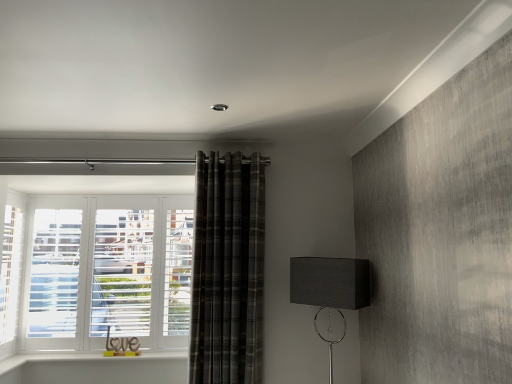
Locate an element on the screen. plaid fabric curtain at center is located at coordinates (228, 270).

Describe the element at coordinates (228, 270) in the screenshot. I see `plaid fabric curtain at center` at that location.

Measure the distance between point (257, 185) and camera.

They are 8.64 feet apart.

What do you see at coordinates (330, 288) in the screenshot? I see `matte black rectangular lampshade at lower right` at bounding box center [330, 288].

Image resolution: width=512 pixels, height=384 pixels. I want to click on matte black rectangular lampshade at lower right, so click(x=330, y=288).

Image resolution: width=512 pixels, height=384 pixels. I want to click on plaid fabric curtain at center, so click(x=228, y=270).

Which object is positioned more to the right, matte black rectangular lampshade at lower right or plaid fabric curtain at center?

From the viewer's perspective, matte black rectangular lampshade at lower right appears more on the right side.

Is matte black rectangular lampshade at lower right closer to camera compared to plaid fabric curtain at center?

Yes, matte black rectangular lampshade at lower right is closer to the camera.

Is point (307, 297) positioned before point (225, 173)?

That is True.

From the image's perspective, does matte black rectangular lampshade at lower right appear lower than plaid fabric curtain at center?

Yes, from the image's perspective, matte black rectangular lampshade at lower right is below plaid fabric curtain at center.

From a real-world perspective, is matte black rectangular lampshade at lower right on plaid fabric curtain at center?

No, from a real-world perspective, matte black rectangular lampshade at lower right is not over plaid fabric curtain at center

In terms of width, does matte black rectangular lampshade at lower right look wider or thinner when compared to plaid fabric curtain at center?

Clearly, matte black rectangular lampshade at lower right has more width compared to plaid fabric curtain at center.

Which of these two, matte black rectangular lampshade at lower right or plaid fabric curtain at center, stands taller?

Standing taller between the two is plaid fabric curtain at center.

Between matte black rectangular lampshade at lower right and plaid fabric curtain at center, which one has larger size?

plaid fabric curtain at center is bigger.

Choose the correct answer: Is matte black rectangular lampshade at lower right inside plaid fabric curtain at center or outside it?

The correct answer is: outside.

Would you say matte black rectangular lampshade at lower right is a long distance from plaid fabric curtain at center?

No, matte black rectangular lampshade at lower right is not far away from plaid fabric curtain at center.

Is matte black rectangular lampshade at lower right oriented away from plaid fabric curtain at center?

No, matte black rectangular lampshade at lower right is not facing away from plaid fabric curtain at center.

Can you tell me how much matte black rectangular lampshade at lower right and plaid fabric curtain at center differ in facing direction?

The angular difference between matte black rectangular lampshade at lower right and plaid fabric curtain at center is 35.5 degrees.

Where is `table lamp directly beneath the plaid fabric curtain at center (from a real-world perspective)`? Image resolution: width=512 pixels, height=384 pixels. table lamp directly beneath the plaid fabric curtain at center (from a real-world perspective) is located at coordinates (330, 288).

In the image, is plaid fabric curtain at center on the left side or the right side of matte black rectangular lampshade at lower right?

Based on their positions, plaid fabric curtain at center is located to the left of matte black rectangular lampshade at lower right.

Is plaid fabric curtain at center positioned behind matte black rectangular lampshade at lower right?

Yes.

Is point (248, 178) positioned after point (290, 297)?

Yes.

From the image's perspective, between plaid fabric curtain at center and matte black rectangular lampshade at lower right, who is located below?

From the image's view, matte black rectangular lampshade at lower right is below.

From a real-world perspective, is plaid fabric curtain at center above or below matte black rectangular lampshade at lower right?

plaid fabric curtain at center is situated higher than matte black rectangular lampshade at lower right in the real world.

Does plaid fabric curtain at center have a lesser width compared to matte black rectangular lampshade at lower right?

Yes, plaid fabric curtain at center is thinner than matte black rectangular lampshade at lower right.

Considering the sizes of objects plaid fabric curtain at center and matte black rectangular lampshade at lower right in the image provided, who is taller, plaid fabric curtain at center or matte black rectangular lampshade at lower right?

plaid fabric curtain at center is taller.

Who is smaller, plaid fabric curtain at center or matte black rectangular lampshade at lower right?

Smaller between the two is matte black rectangular lampshade at lower right.

Looking at this image, is plaid fabric curtain at center completely or partially outside of matte black rectangular lampshade at lower right?

Yes, plaid fabric curtain at center is outside of matte black rectangular lampshade at lower right.

Are plaid fabric curtain at center and matte black rectangular lampshade at lower right beside each other?

No, plaid fabric curtain at center is not touching matte black rectangular lampshade at lower right.

Is plaid fabric curtain at center oriented away from matte black rectangular lampshade at lower right?

plaid fabric curtain at center does not have its back to matte black rectangular lampshade at lower right.

How many degrees apart are the facing directions of plaid fabric curtain at center and matte black rectangular lampshade at lower right?

plaid fabric curtain at center and matte black rectangular lampshade at lower right are facing 35.5 degrees away from each other.

The image size is (512, 384). In the image, there is a plaid fabric curtain at center. Find the location of `table lamp below it (from the image's perspective)`. table lamp below it (from the image's perspective) is located at coordinates (330, 288).

This screenshot has height=384, width=512. What are the coordinates of `curtain lying above the matte black rectangular lampshade at lower right (from the image's perspective)` in the screenshot? It's located at (228, 270).

Locate an element on the screen. The height and width of the screenshot is (384, 512). table lamp lying below the plaid fabric curtain at center (from the image's perspective) is located at coordinates (330, 288).